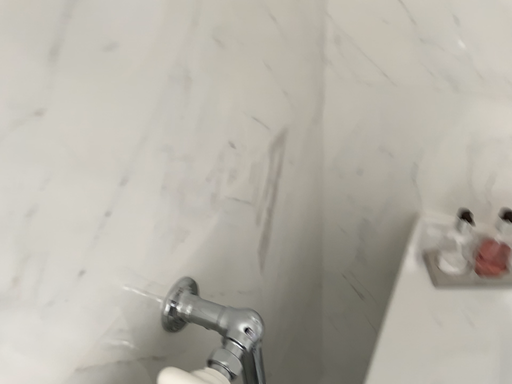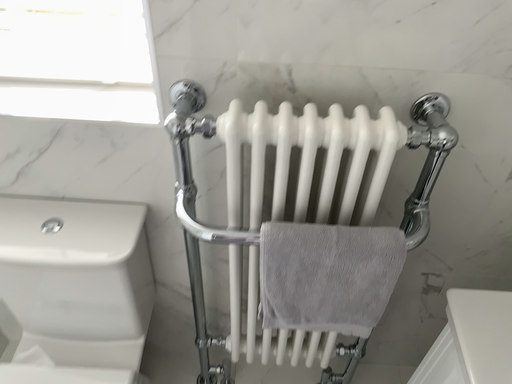
Question: How did the camera likely rotate when shooting the video?

Choices:
 (A) rotated right
 (B) rotated left

Answer: (B)